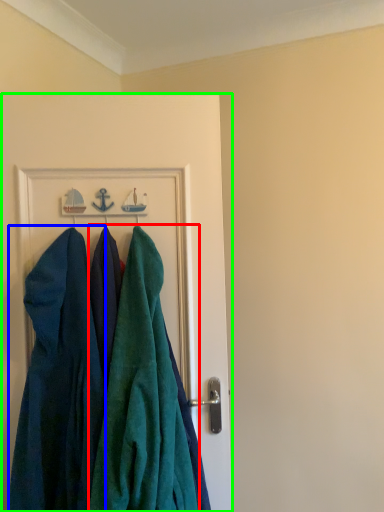
Question: Which object is the closest to the towel (highlighted by a red box)? Choose among these: dress (highlighted by a blue box) or door (highlighted by a green box).

Choices:
 (A) dress
 (B) door

Answer: (A)